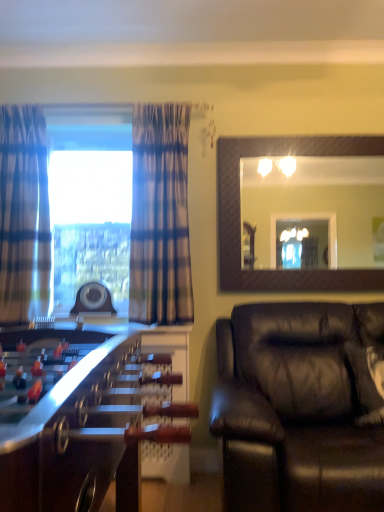
I want to click on vacant region above matte brown mirror at upper right (from a real-world perspective), so click(306, 136).